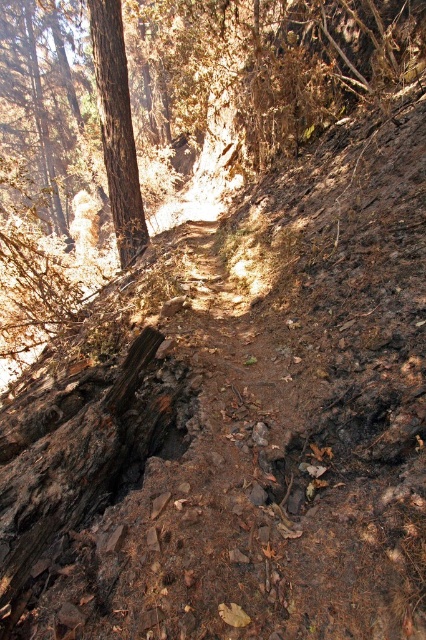
This screenshot has height=640, width=426. I want to click on charcoal textured log at lower left, so click(77, 456).

Is the position of charcoal textured log at lower left less distant than that of brown rough tree at left?

That is True.

Measure the distance between point (109, 400) and camera.

Point (109, 400) is 8.85 feet away from camera.

Locate an element on the screen. This screenshot has height=640, width=426. charcoal textured log at lower left is located at coordinates (77, 456).